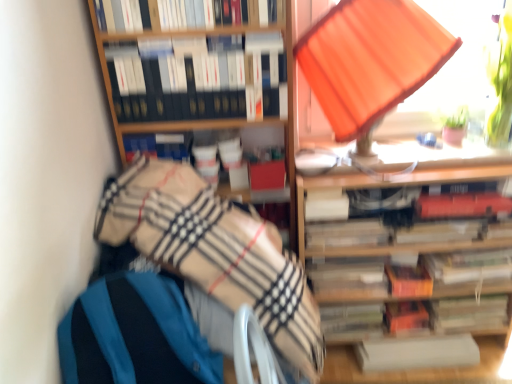
Question: From the image's perspective, is hardcover books at upper center, positioned as the 1th book in top-to-bottom order, positioned above or below beige plaid blanket at lower left?

Choices:
 (A) above
 (B) below

Answer: (A)

Question: In terms of size, does hardcover books at upper center, positioned as the 1th book in top-to-bottom order, appear bigger or smaller than beige plaid blanket at lower left?

Choices:
 (A) small
 (B) big

Answer: (A)

Question: Estimate the real-world distances between objects in this image. Which object is farther from the hardcover book at center, the second book in the bottom-to-top sequence?

Choices:
 (A) orange fabric lampshade at upper right
 (B) hardcover book at center, positioned as the 3th paperback book in top-to-bottom order
 (C) hardcover book at center, positioned as the 9th paperback book in top-to-bottom order
 (D) wooden bookshelf at upper right
 (E) hardcover book at center right, which ranks as the ninth paperback book in bottom-to-top order

Answer: (A)

Question: Which object is the farthest from the beige plaid blanket at lower left?

Choices:
 (A) hardcover book at center, acting as the 5th paperback book starting from the bottom
 (B) white paper at lower right, which is the fourth book in top-to-bottom order
 (C) hardcover book at center, acting as the seventh paperback book starting from the bottom
 (D) orange matte book at center, which is the 4th paperback book from bottom to top
 (E) hardcover book at center, which is counted as the 2th book, starting from the back

Answer: (E)